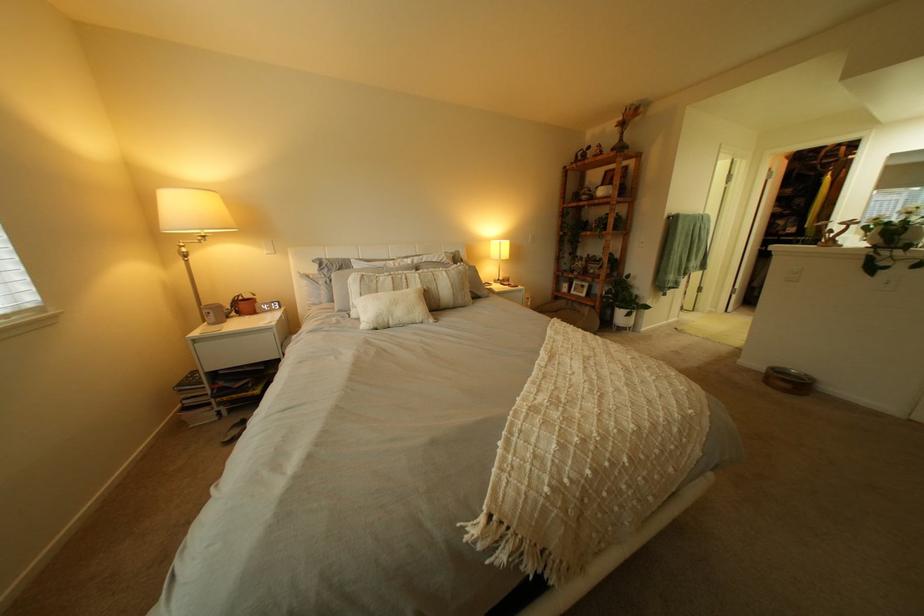
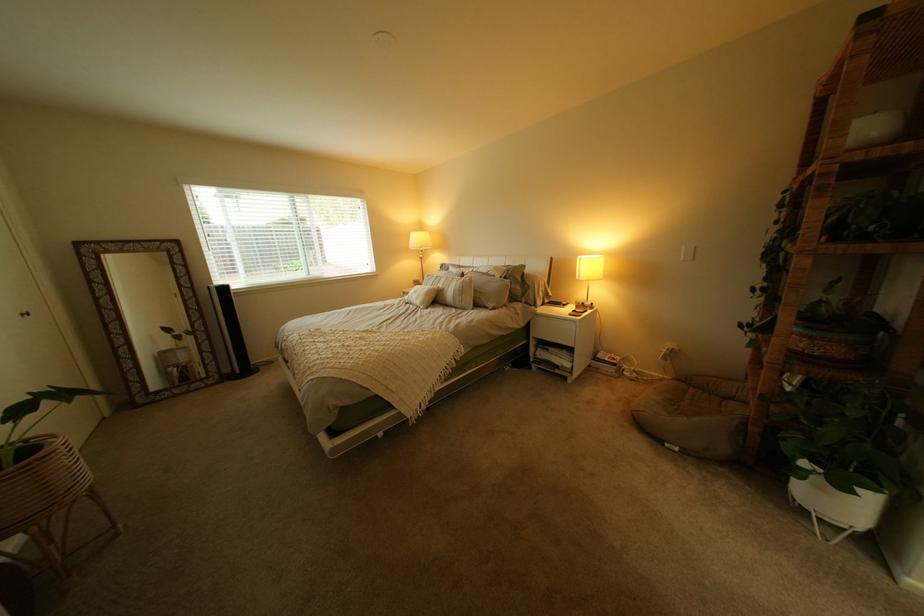
Find the pixel in the second image that matches the point at 636,331 in the first image.

(821, 512)